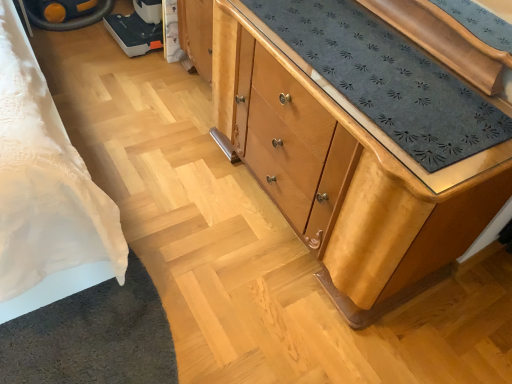
You are a GUI agent. You are given a task and a screenshot of the screen. Output one action in this format:
    pyautogui.click(x=<x>, y=<y>)
    Task: Click on the vacant region in front of yellow rubber wheel at upper left
    The height and width of the screenshot is (384, 512).
    Given the screenshot: What is the action you would take?
    pyautogui.click(x=80, y=56)